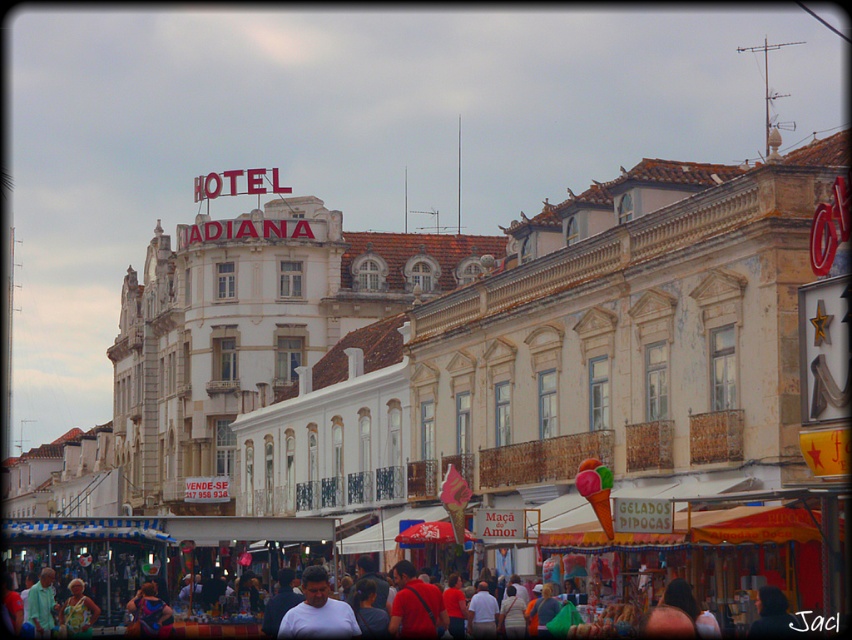
Between white matte shirt at center and red fabric shirt at center, which one has more height?

white matte shirt at center is taller.

Is white matte shirt at center in front of red fabric shirt at center?

Yes, it is.

Is point (337, 634) farther from viewer compared to point (421, 609)?

No.

Where is `white matte shirt at center`? Image resolution: width=852 pixels, height=640 pixels. white matte shirt at center is located at coordinates (317, 611).

Can you confirm if white matte shirt at center is positioned below floral printed dress at center?

No.

Is white matte shirt at center wider than floral printed dress at center?

Yes.

Is point (297, 625) positioned after point (76, 605)?

No, (297, 625) is closer to viewer.

This screenshot has width=852, height=640. Identify the location of white matte shirt at center. (317, 611).

Is red fabric shirt at center thinner than floral printed dress at center?

Incorrect, red fabric shirt at center's width is not less than floral printed dress at center's.

This screenshot has width=852, height=640. In order to click on red fabric shirt at center in this screenshot , I will do `click(415, 604)`.